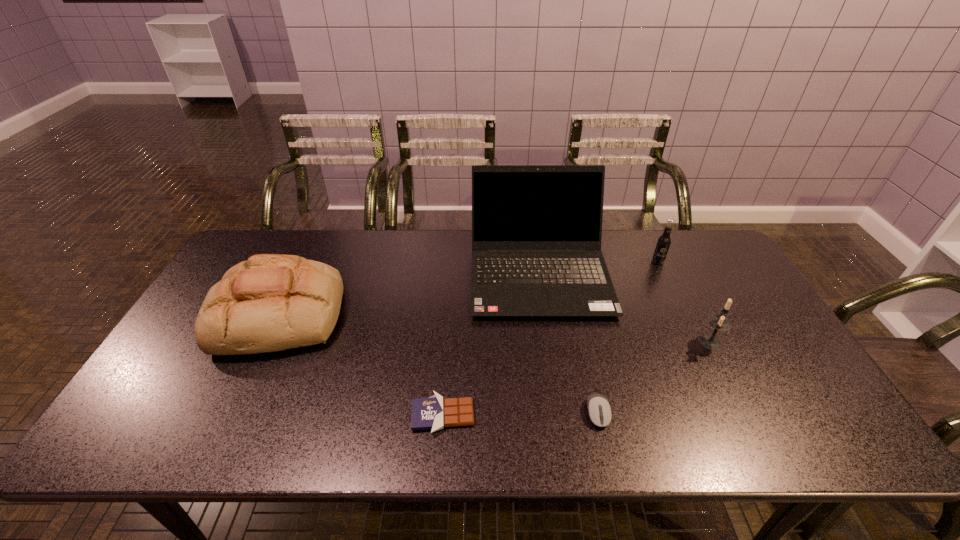
The height and width of the screenshot is (540, 960). Find the location of `free space between the second shortest object and the tallest object`. free space between the second shortest object and the tallest object is located at coordinates (568, 341).

Locate an element on the screen. vacant area that lies between the bread and the candle holder is located at coordinates (495, 328).

Identify the location of empty location between the leftmost object and the tallest object. (409, 292).

The image size is (960, 540). I want to click on free area in between the computer equipment and the leftmost object, so click(x=439, y=363).

The image size is (960, 540). Find the location of `empty space between the second shortest object and the tallest object`. empty space between the second shortest object and the tallest object is located at coordinates (568, 341).

Locate an element on the screen. This screenshot has width=960, height=540. vacant point located between the shortest object and the bread is located at coordinates click(362, 365).

Where is `vacant space in between the shortest object and the leftmost object`? This screenshot has width=960, height=540. vacant space in between the shortest object and the leftmost object is located at coordinates (362, 365).

At what (x,y) coordinates should I click in order to perform the action: click on free spot between the shortest object and the bread. Please return your answer as a coordinate pair (x, y). Looking at the image, I should click on (362, 365).

Where is `free point between the candle holder and the shortest object`? free point between the candle holder and the shortest object is located at coordinates (576, 379).

Locate an element on the screen. object that stands as the closest to the leftmost object is located at coordinates pos(435,413).